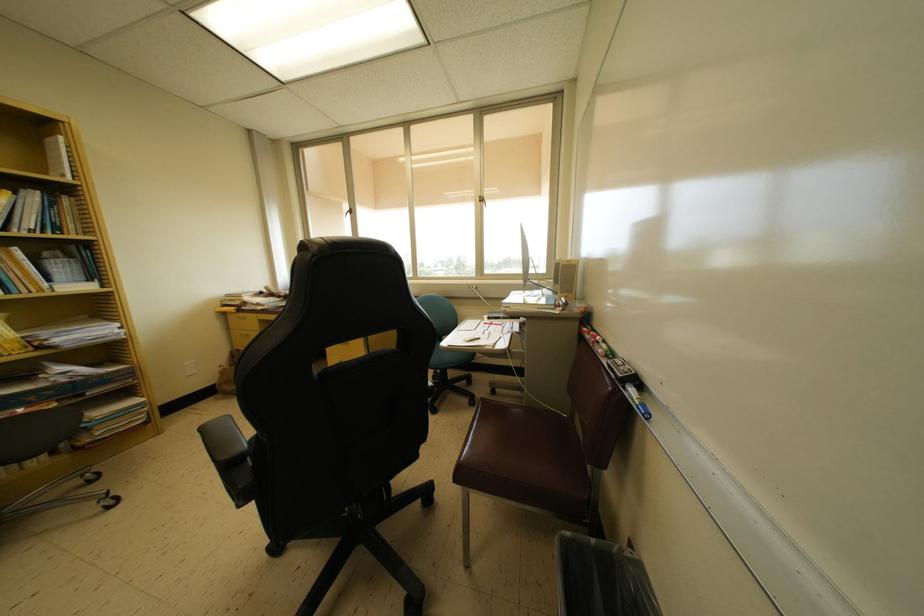
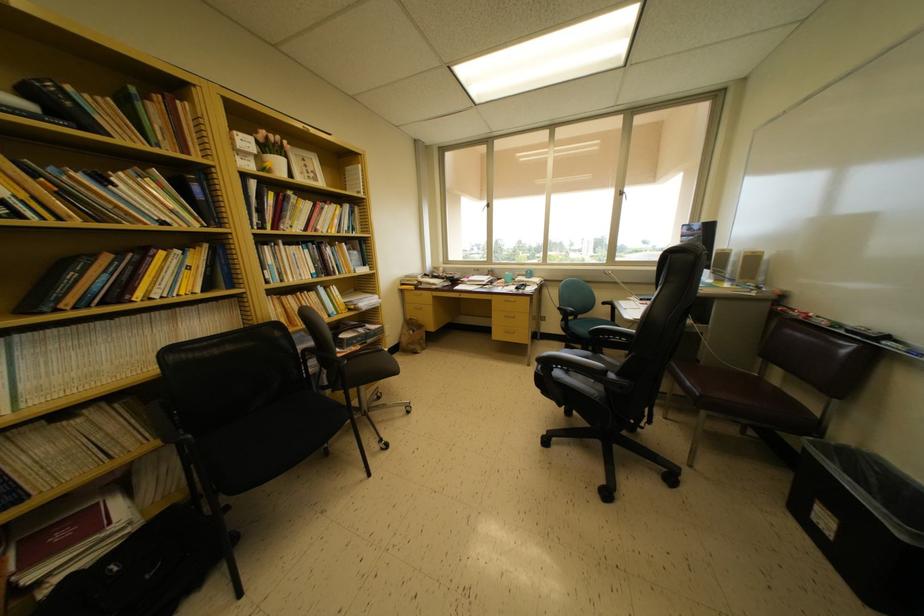
The images are taken continuously from a first-person perspective. In which direction are you moving?

The movement direction of the cameraman is left, backward.